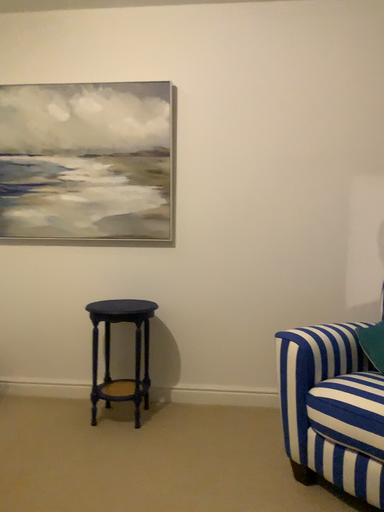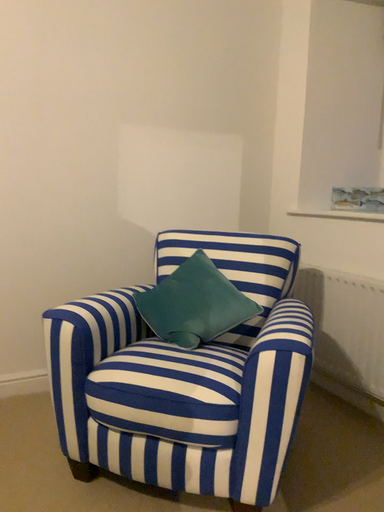
Question: How did the camera likely rotate when shooting the video?

Choices:
 (A) rotated right
 (B) rotated left

Answer: (A)